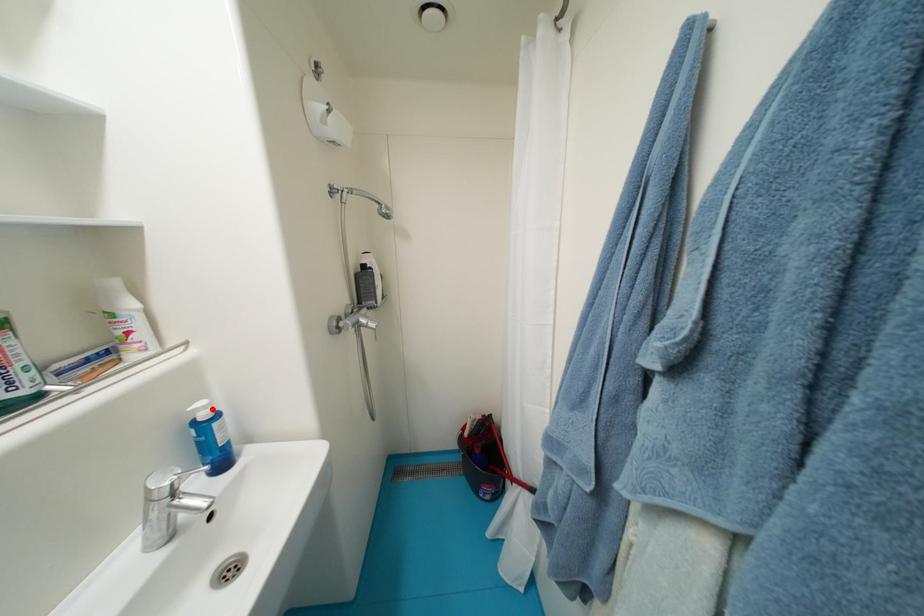
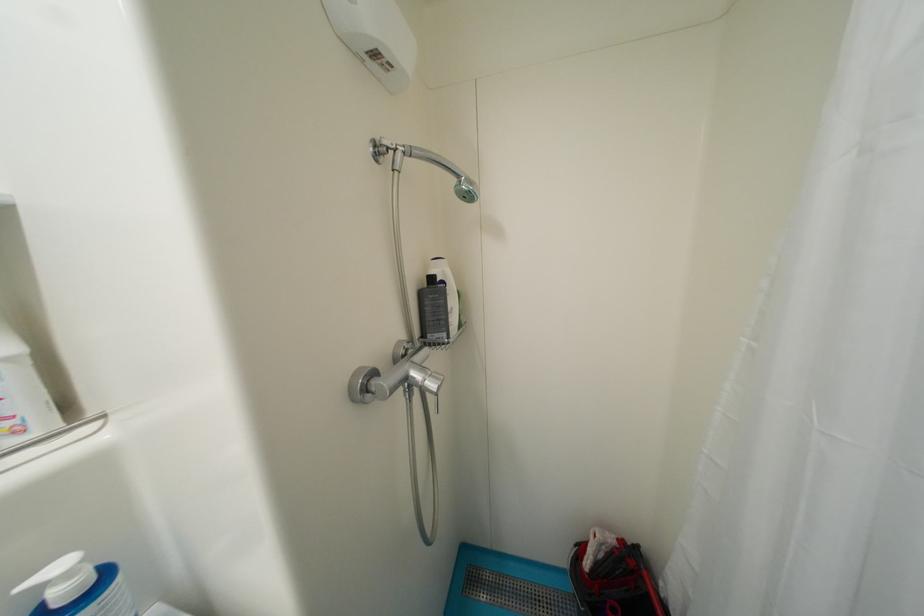
Where in the second image is the point corresponding to the highlighted location from the first image?

(75, 576)